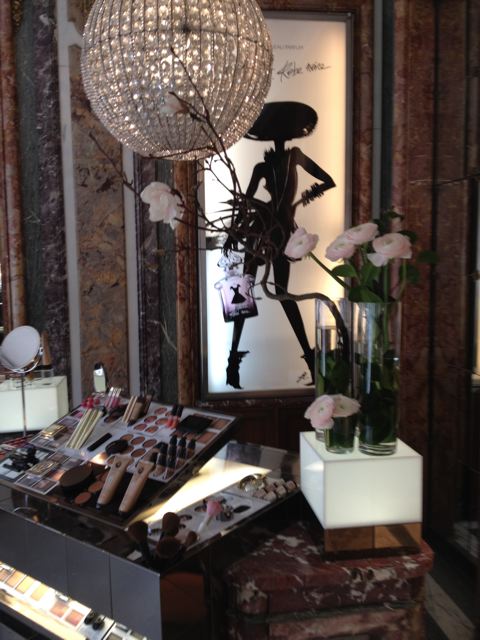
This screenshot has width=480, height=640. What are the coordinates of `vase` in the screenshot? It's located at (387, 381), (334, 362).